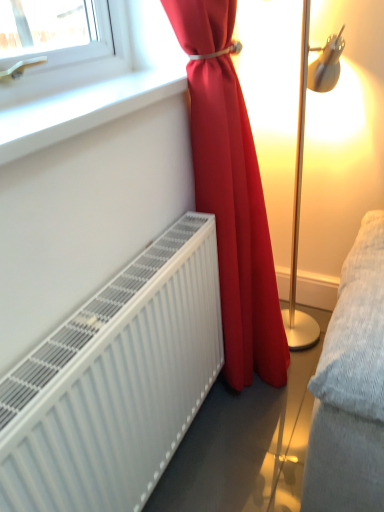
Question: Does point (57, 97) appear closer or farther from the camera than point (218, 167)?

Choices:
 (A) closer
 (B) farther

Answer: (A)

Question: Looking at their shapes, would you say white smooth window sill at upper left is wider or thinner than matte red curtain at center?

Choices:
 (A) wide
 (B) thin

Answer: (B)

Question: Which of these objects is positioned farthest from the white smooth window sill at upper left?

Choices:
 (A) matte red curtain at center
 (B) white matte radiator at lower left

Answer: (B)

Question: Estimate the real-world distances between objects in this image. Which object is closer to the white smooth window sill at upper left?

Choices:
 (A) matte red curtain at center
 (B) white matte radiator at lower left

Answer: (A)